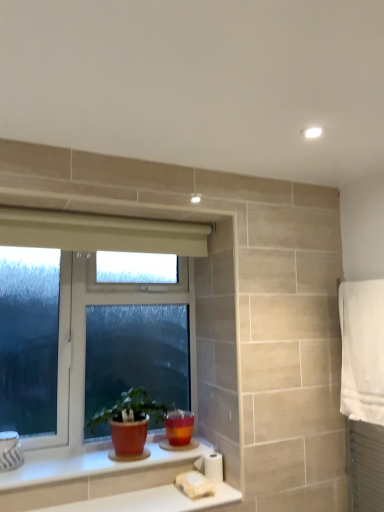
Question: Is matte terracotta pot at lower center not near white glossy counter top at lower center, acting as the 1th counter top starting from the bottom?

Choices:
 (A) yes
 (B) no

Answer: (B)

Question: Considering the relative sizes of matte terracotta pot at lower center and white glossy counter top at lower center, which is the second counter top in top-to-bottom order, in the image provided, is matte terracotta pot at lower center taller than white glossy counter top at lower center, which is the second counter top in top-to-bottom order,?

Choices:
 (A) no
 (B) yes

Answer: (B)

Question: Considering the relative sizes of matte terracotta pot at lower center and white glossy counter top at lower center, which is the second counter top in top-to-bottom order, in the image provided, is matte terracotta pot at lower center smaller than white glossy counter top at lower center, which is the second counter top in top-to-bottom order,?

Choices:
 (A) no
 (B) yes

Answer: (A)

Question: From a real-world perspective, is matte terracotta pot at lower center below white glossy counter top at lower center, which is the second counter top in top-to-bottom order?

Choices:
 (A) yes
 (B) no

Answer: (B)

Question: From a real-world perspective, is matte terracotta pot at lower center positioned over white glossy counter top at lower center, which is the second counter top in top-to-bottom order, based on gravity?

Choices:
 (A) no
 (B) yes

Answer: (B)

Question: From a real-world perspective, relative to white cotton towel at right, is matte terracotta pot at lower center vertically above or below?

Choices:
 (A) below
 (B) above

Answer: (A)

Question: From the image's perspective, is matte terracotta pot at lower center located above or below white cotton towel at right?

Choices:
 (A) below
 (B) above

Answer: (A)

Question: From their relative heights in the image, would you say matte terracotta pot at lower center is taller or shorter than white cotton towel at right?

Choices:
 (A) tall
 (B) short

Answer: (B)

Question: Relative to white cotton towel at right, is matte terracotta pot at lower center in front or behind?

Choices:
 (A) front
 (B) behind

Answer: (B)

Question: From a real-world perspective, is white plastic window at lower left positioned above or below white cotton towel at right?

Choices:
 (A) below
 (B) above

Answer: (B)

Question: In terms of size, does white plastic window at lower left appear bigger or smaller than white cotton towel at right?

Choices:
 (A) big
 (B) small

Answer: (A)

Question: From the image's perspective, relative to white cotton towel at right, is white plastic window at lower left above or below?

Choices:
 (A) below
 (B) above

Answer: (A)

Question: Which is correct: white plastic window at lower left is inside white cotton towel at right, or outside of it?

Choices:
 (A) inside
 (B) outside

Answer: (B)

Question: Choose the correct answer: Is white glossy counter top at lower center, acting as the 1th counter top starting from the bottom, inside white cotton towel at right or outside it?

Choices:
 (A) outside
 (B) inside

Answer: (A)

Question: Looking at their shapes, would you say white glossy counter top at lower center, acting as the 1th counter top starting from the bottom, is wider or thinner than white cotton towel at right?

Choices:
 (A) thin
 (B) wide

Answer: (B)